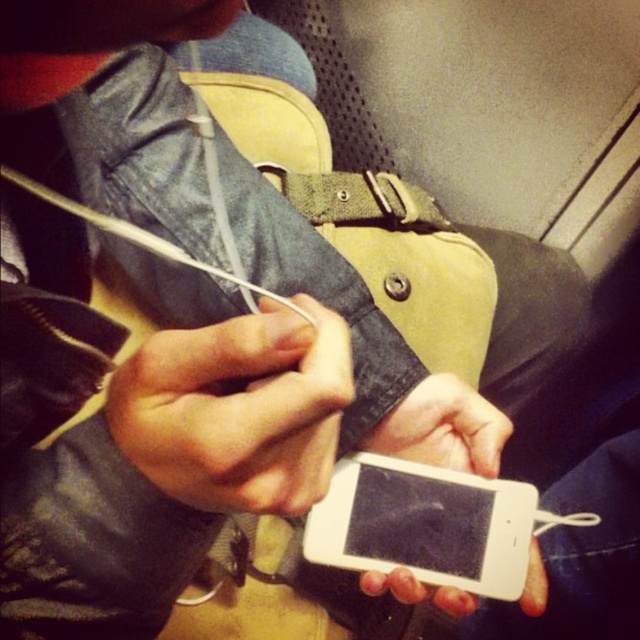
You are a delivery person who needs to place both the matte black phone at center and the white matte phone at center into a box that can only hold items up to 6 inches in length. Can both phones fit side by side in the box without overlapping?

The matte black phone at center and white matte phone at center are 6.00 inches apart from each other. Since the box can hold up to 6 inches, the two phones can fit side by side in the box without overlapping as their combined length is exactly 6 inches.

You are trying to locate the matte black phone at center in the image. According to the coordinates provided, where exactly is it positioned?

The matte black phone at center is located at point 0.641 on the x axis and 0.372 on the y axis.

You are a photographer adjusting the lighting in a studio setup. You notice two phones, a matte black phone at center and a white matte phone at center, in the scene. Which phone should you position closer to the light source to ensure proper exposure?

The white matte phone at center should be positioned closer to the light source because lighter colors reflect more light and may require less direct illumination to achieve proper exposure compared to the matte black phone at center, which absorbs more light and might need more light to appear adequately lit.